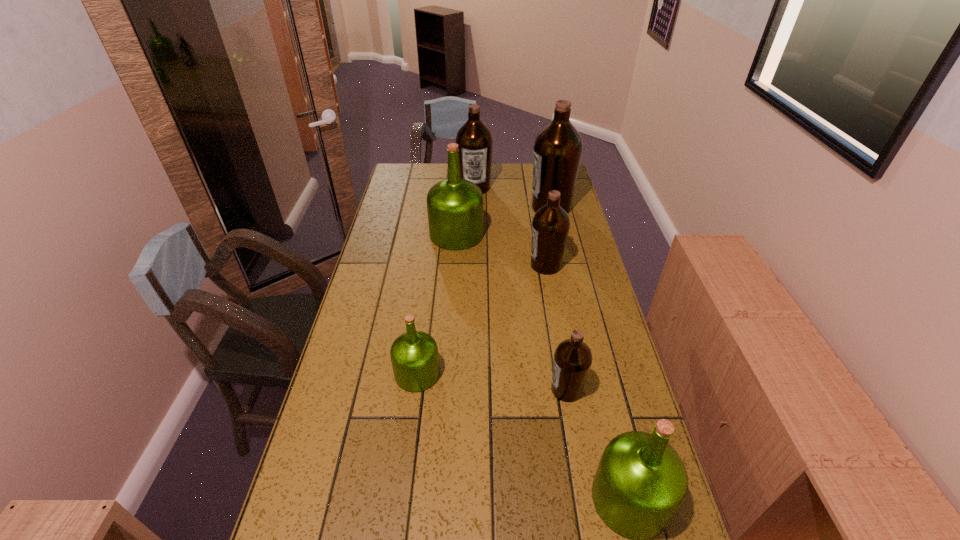
At what (x,y) coordinates should I click in order to perform the action: click on vacant space located on the label of the biggest brown olive oil. Please return your answer as a coordinate pair (x, y). Image resolution: width=960 pixels, height=540 pixels. Looking at the image, I should click on (467, 207).

What are the coordinates of `blank space located 0.400m on the label of the biggest brown olive oil` in the screenshot? It's located at (436, 207).

In order to click on free region located on the label of the leftmost brown olive oil in this screenshot , I will do `click(474, 202)`.

At what (x,y) coordinates should I click in order to perform the action: click on vacant area situated 0.190m on the back of the fifth nearest olive oil. Please return your answer as a coordinate pair (x, y). This screenshot has height=540, width=960. Looking at the image, I should click on (459, 196).

Locate an element on the screen. The image size is (960, 540). vacant position located 0.290m on the label of the fourth farthest olive oil is located at coordinates (449, 265).

Locate an element on the screen. The height and width of the screenshot is (540, 960). vacant space situated 0.050m on the label of the fourth farthest olive oil is located at coordinates (515, 265).

Where is `vacant space located on the label of the fourth farthest olive oil`? This screenshot has height=540, width=960. vacant space located on the label of the fourth farthest olive oil is located at coordinates (501, 265).

At what (x,y) coordinates should I click in order to perform the action: click on vacant position located 0.380m on the back of the smallest green olive oil. Please return your answer as a coordinate pair (x, y). The height and width of the screenshot is (540, 960). Looking at the image, I should click on (431, 272).

Locate an element on the screen. The image size is (960, 540). free point located on the label of the smallest brown olive oil is located at coordinates tap(424, 389).

I want to click on vacant space located on the label of the smallest brown olive oil, so click(x=414, y=389).